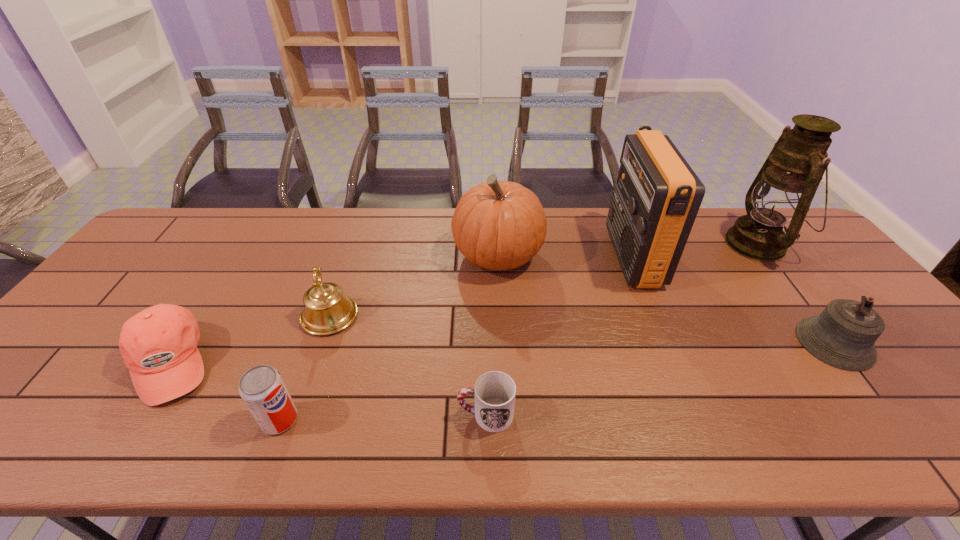
At what (x,y) coordinates should I click in order to perform the action: click on free spot that satisfies the following two spatial constraints: 1. on the back side of the leftmost object; 2. on the right side of the tallest object. Please return your answer as a coordinate pair (x, y). Image resolution: width=960 pixels, height=540 pixels. Looking at the image, I should click on (246, 244).

The width and height of the screenshot is (960, 540). I want to click on vacant area that satisfies the following two spatial constraints: 1. on the stem of the sixth shortest object; 2. on the right side of the right bell, so click(x=502, y=343).

Find the location of a particular element. free space that satisfies the following two spatial constraints: 1. on the back side of the soda; 2. on the right side of the right bell is located at coordinates (308, 343).

Where is `free spot that satisfies the following two spatial constraints: 1. on the front side of the right bell; 2. on the right side of the left bell`? free spot that satisfies the following two spatial constraints: 1. on the front side of the right bell; 2. on the right side of the left bell is located at coordinates (321, 343).

In order to click on free location that satisfies the following two spatial constraints: 1. on the stem of the pumpkin; 2. on the right side of the right bell in this screenshot , I will do `click(502, 343)`.

Image resolution: width=960 pixels, height=540 pixels. What are the coordinates of `vacant space that satisfies the following two spatial constraints: 1. on the front-facing side of the right bell; 2. on the left side of the seventh shortest object` in the screenshot? It's located at (667, 343).